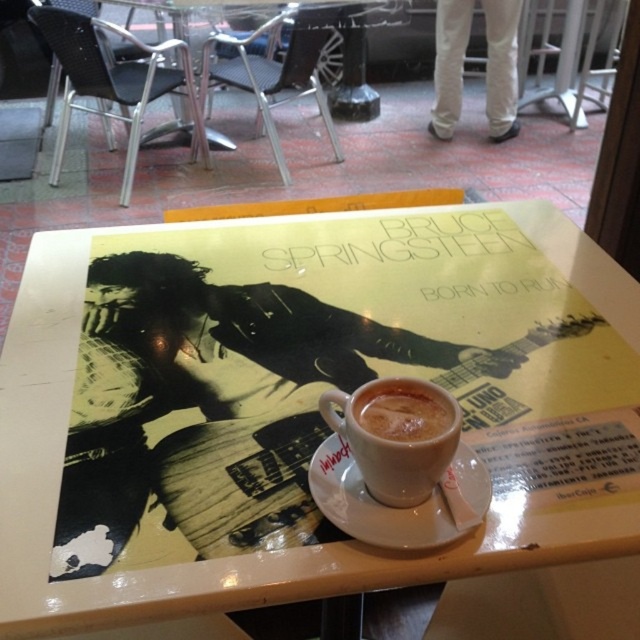
Is white glossy table at center further to camera compared to cappuccino foam cup at center?

No, white glossy table at center is closer to the viewer.

The width and height of the screenshot is (640, 640). What do you see at coordinates (300, 403) in the screenshot?
I see `white glossy table at center` at bounding box center [300, 403].

Where is `white glossy table at center`? white glossy table at center is located at coordinates [x=300, y=403].

Can you confirm if white ceramic saucer at center is bigger than white frothy coffee at center?

Indeed, white ceramic saucer at center has a larger size compared to white frothy coffee at center.

Is white ceramic saucer at center taller than white frothy coffee at center?

Yes.

Is point (461, 522) farther from camera compared to point (417, 397)?

That is False.

The image size is (640, 640). Find the location of `white ceramic saucer at center`. white ceramic saucer at center is located at coordinates (397, 508).

Is white glossy table at center thinner than white frothy coffee at center?

Incorrect, white glossy table at center's width is not less than white frothy coffee at center's.

From the picture: Is white glossy table at center further to camera compared to white frothy coffee at center?

That is False.

From the picture: Who is more distant from viewer, (308, 513) or (445, 408)?

A: The point (308, 513) is more distant.

Identify the location of white glossy table at center. The width and height of the screenshot is (640, 640). (300, 403).